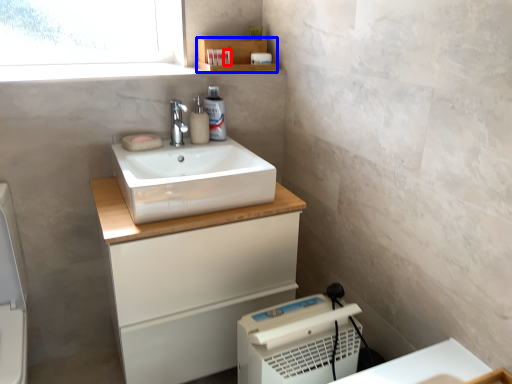
Question: Which of the following is the closest to the observer, toiletry (highlighted by a red box) or shelf (highlighted by a blue box)?

Choices:
 (A) toiletry
 (B) shelf

Answer: (B)